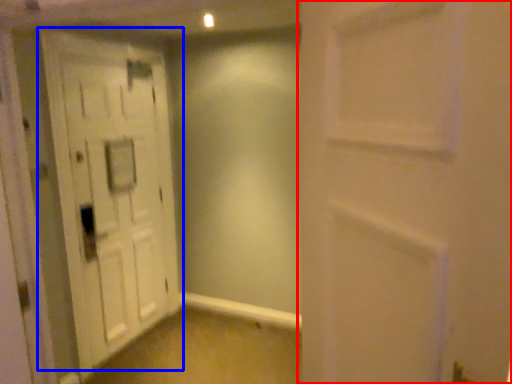
Question: Which point is further to the camera, door (highlighted by a red box) or door (highlighted by a blue box)?

Choices:
 (A) door
 (B) door

Answer: (B)